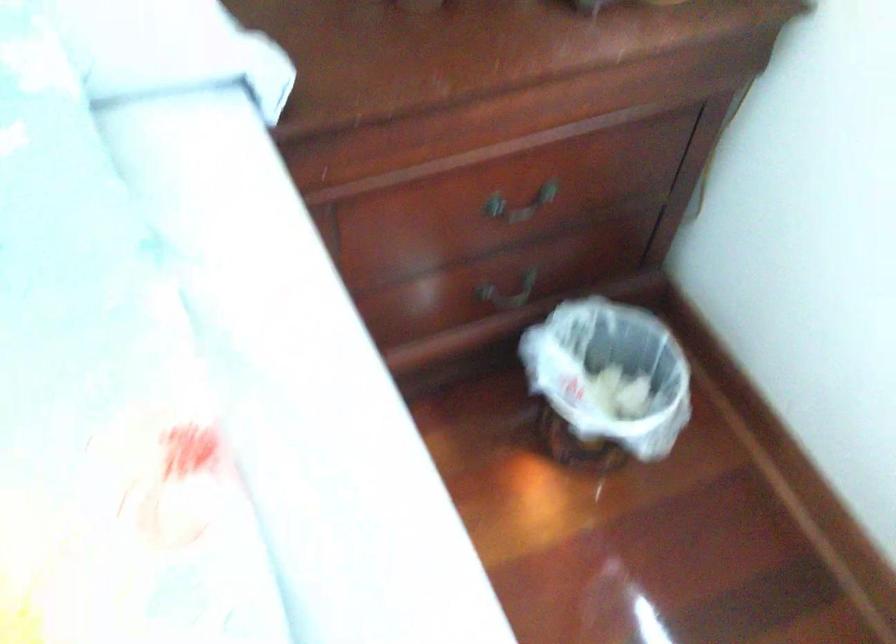
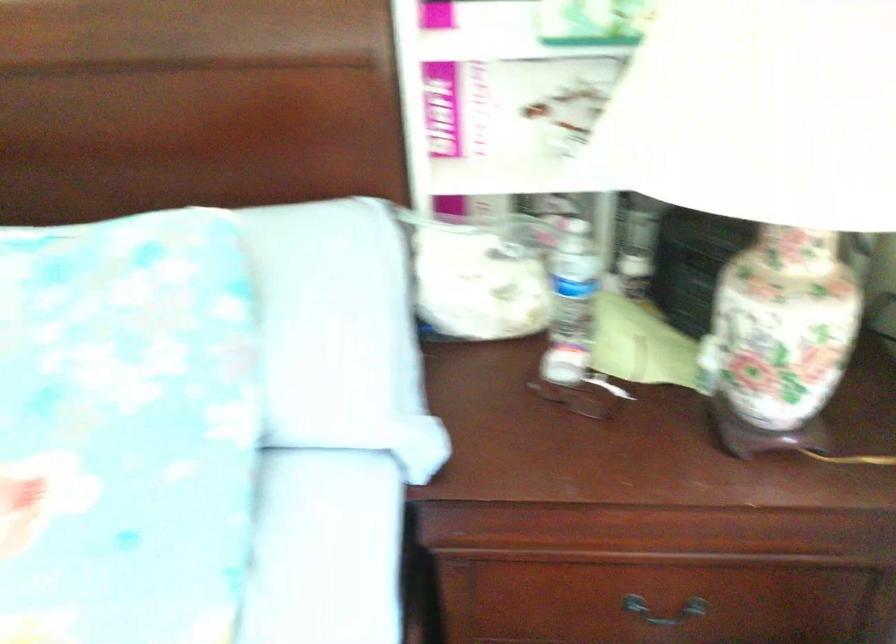
The first image is from the beginning of the video and the second image is from the end. How did the camera likely rotate when shooting the video?

The camera's rotation is toward left-up.